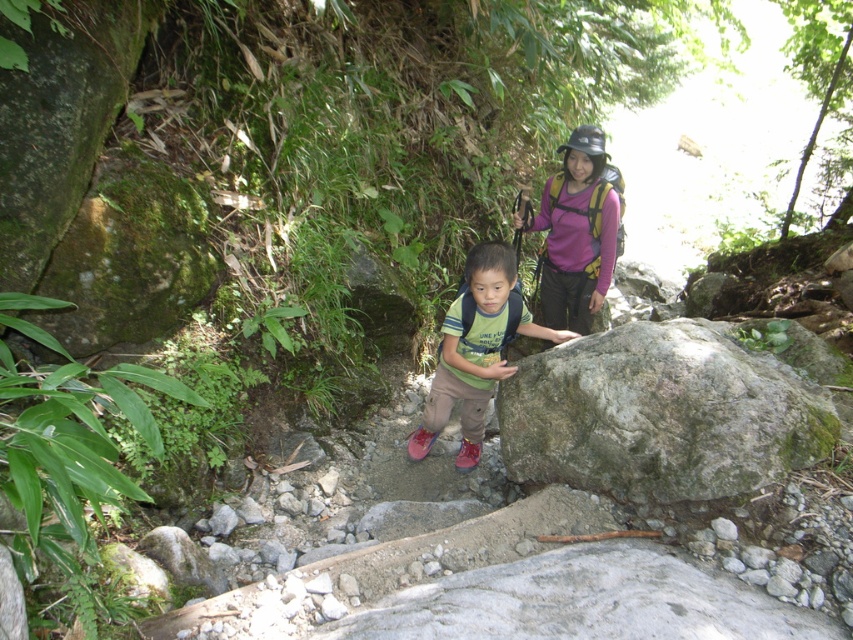
Who is taller, green mossy rock at center or purple fabric backpack at upper center?

purple fabric backpack at upper center is taller.

Where is `green mossy rock at center`? The height and width of the screenshot is (640, 853). green mossy rock at center is located at coordinates click(660, 413).

Can you confirm if green mossy rock at center is smaller than green matte shirt at center?

Yes.

Does green mossy rock at center have a lesser width compared to green matte shirt at center?

No.

The image size is (853, 640). What do you see at coordinates (660, 413) in the screenshot?
I see `green mossy rock at center` at bounding box center [660, 413].

Find the location of `green mossy rock at center`. green mossy rock at center is located at coordinates (660, 413).

Is point (473, 317) more distant than point (544, 262)?

That is False.

Find the location of a particular element. The image size is (853, 640). green matte shirt at center is located at coordinates (476, 349).